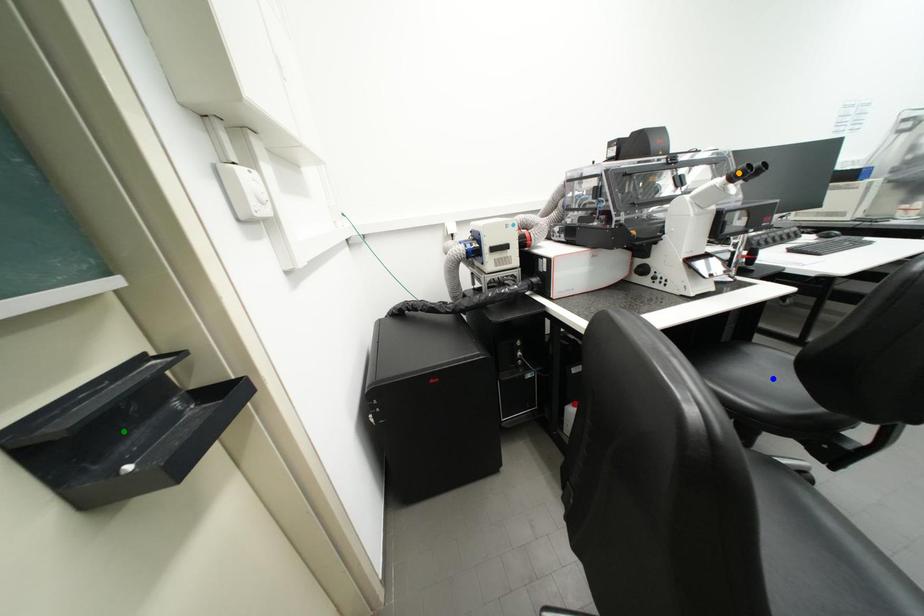
Order these from nearest to farthest:
green point | blue point | orange point

green point
blue point
orange point